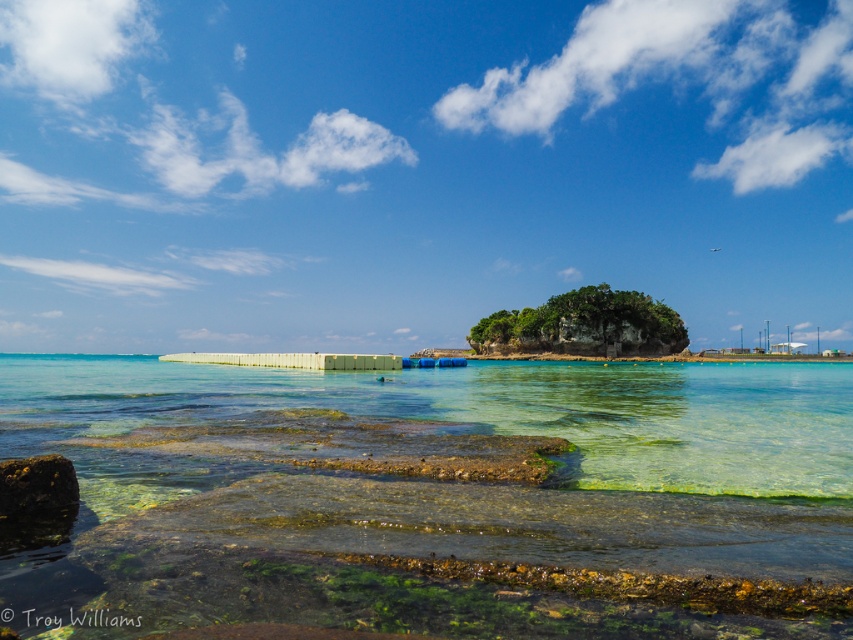
Question: Does clear glass water at center appear on the right side of green mossy rock at center?

Choices:
 (A) yes
 (B) no

Answer: (B)

Question: Estimate the real-world distances between objects in this image. Which object is closer to the clear glass water at center?

Choices:
 (A) rusty metallic rock at lower left
 (B) green mossy rock at center

Answer: (A)

Question: Among these objects, which one is nearest to the camera?

Choices:
 (A) clear glass water at center
 (B) green mossy rock at center
 (C) rusty metallic rock at lower left

Answer: (A)

Question: Which point is closer to the camera taking this photo?

Choices:
 (A) (651, 305)
 (B) (323, 588)

Answer: (B)

Question: Is green mossy rock at center positioned behind rusty metallic rock at lower left?

Choices:
 (A) no
 (B) yes

Answer: (B)

Question: Is clear glass water at center further to the viewer compared to rusty metallic rock at lower left?

Choices:
 (A) yes
 (B) no

Answer: (B)